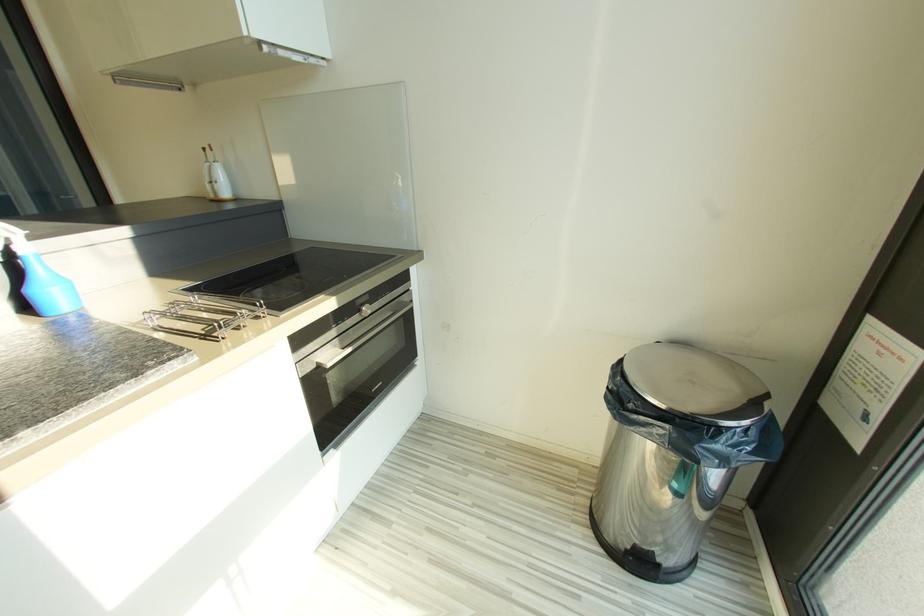
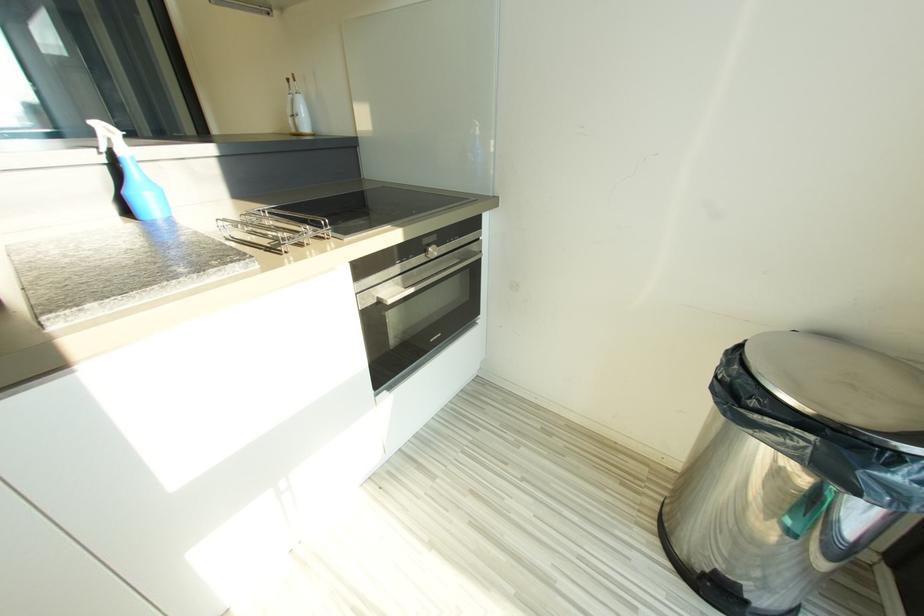
Question: What movement of the cameraman would produce the second image?

Choices:
 (A) Left
 (B) Right
 (C) Forward
 (D) Backward

Answer: (C)